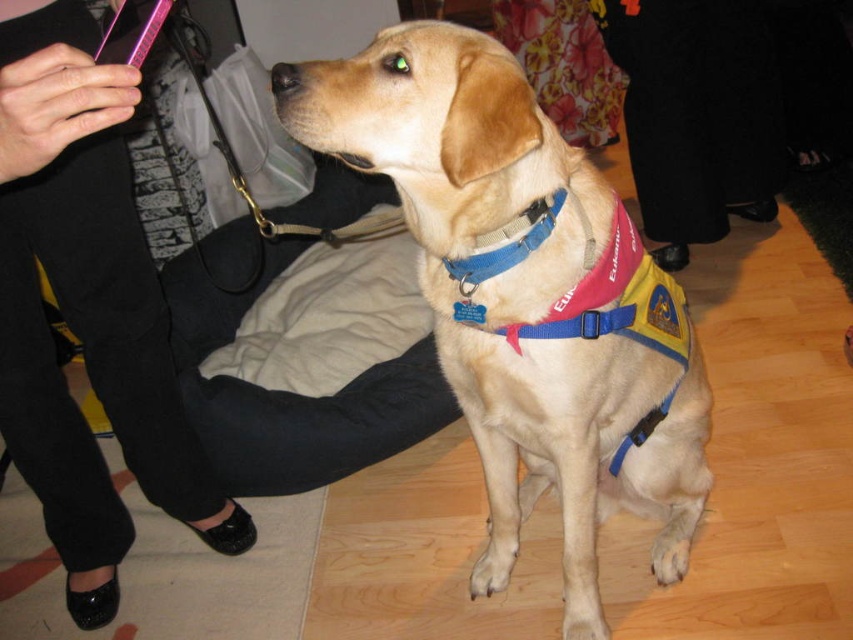
You are standing in front of the Labrador Retriever and want to determine the distance between two points in the image. The first point is at coordinate point(0, 412) and the second point is at coordinate point(726, 51). Based on the image, which point is closer to you?

Point(0, 412) is closer to the viewer than point(726, 51).

You are a service dog trainer assessing the positioning of the dog and the handler in the image. The golden fur vest at center is on the dog, and the black fabric pants at lower left belong to the handler. Based on the scene, can the dog reach the handler by moving forward without any obstacles? Please consider the distance between them.

The distance between the golden fur vest at center and the black fabric pants at lower left is 27.38 inches. Since the dog can easily cover this distance, it can reach the handler by moving forward without any obstacles.